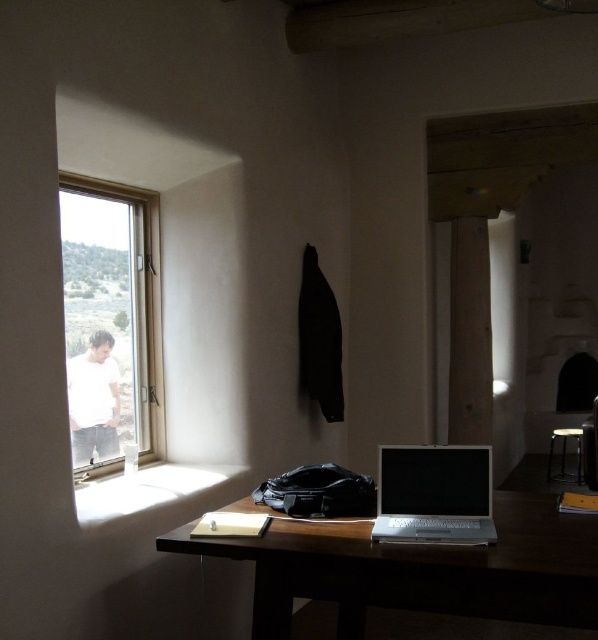
Which is more to the left, clear glass window at left or silver metallic laptop at center?

clear glass window at left

Find the location of a particular element. This screenshot has height=640, width=598. clear glass window at left is located at coordinates (111, 321).

Locate an element on the screen. The width and height of the screenshot is (598, 640). clear glass window at left is located at coordinates (111, 321).

Is point (343, 561) farther from camera compared to point (383, 500)?

No.

Between wooden table at center and silver metallic laptop at center, which one is positioned lower?

wooden table at center is lower down.

Describe the element at coordinates (419, 570) in the screenshot. I see `wooden table at center` at that location.

Find the location of a particular element. wooden table at center is located at coordinates (419, 570).

Which of these two, wooden table at center or clear glass window at left, stands shorter?

With less height is wooden table at center.

Can you confirm if wooden table at center is positioned above clear glass window at left?

Actually, wooden table at center is below clear glass window at left.

Is point (493, 602) positioned before point (135, 241)?

Yes, point (493, 602) is in front of point (135, 241).

You are a GUI agent. You are given a task and a screenshot of the screen. Output one action in this format:
    pyautogui.click(x=<x>, y=<y>)
    Task: Click on the wooden table at center
    This screenshot has height=640, width=598.
    Given the screenshot: What is the action you would take?
    pyautogui.click(x=419, y=570)